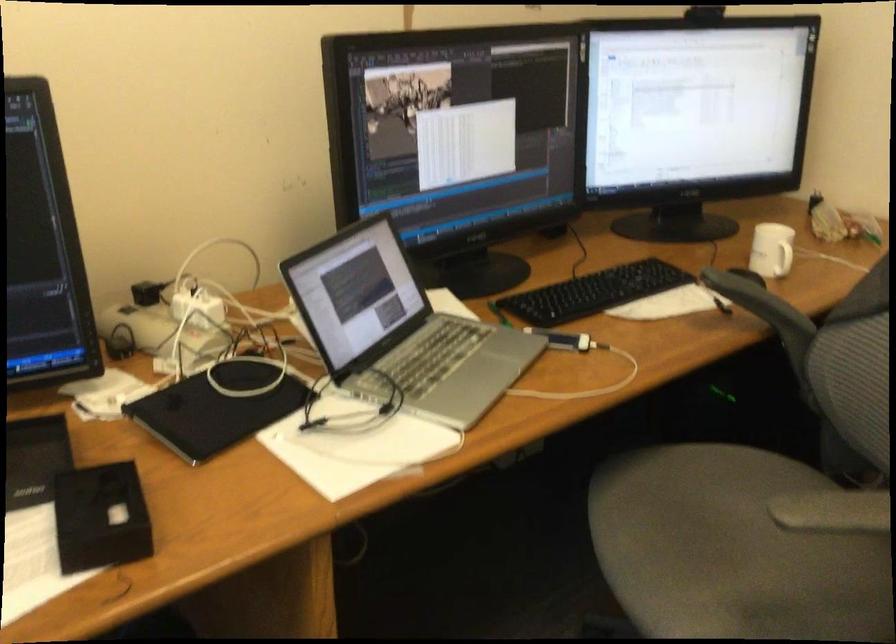
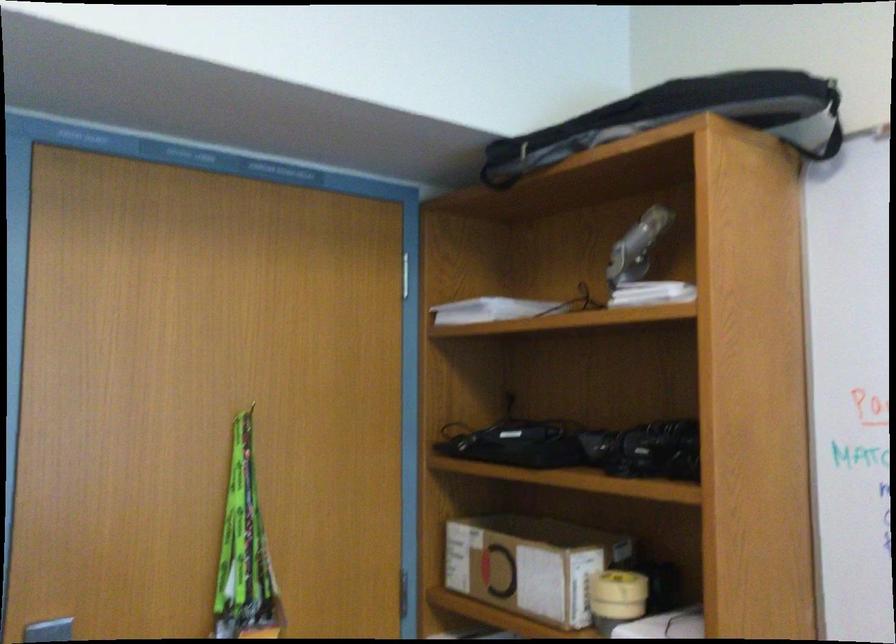
Question: The camera is either moving clockwise (left) or counter-clockwise (right) around the object. The first image is from the beginning of the video and the second image is from the end. Is the camera moving left or right when shooting the video?

Choices:
 (A) Left
 (B) Right

Answer: (A)